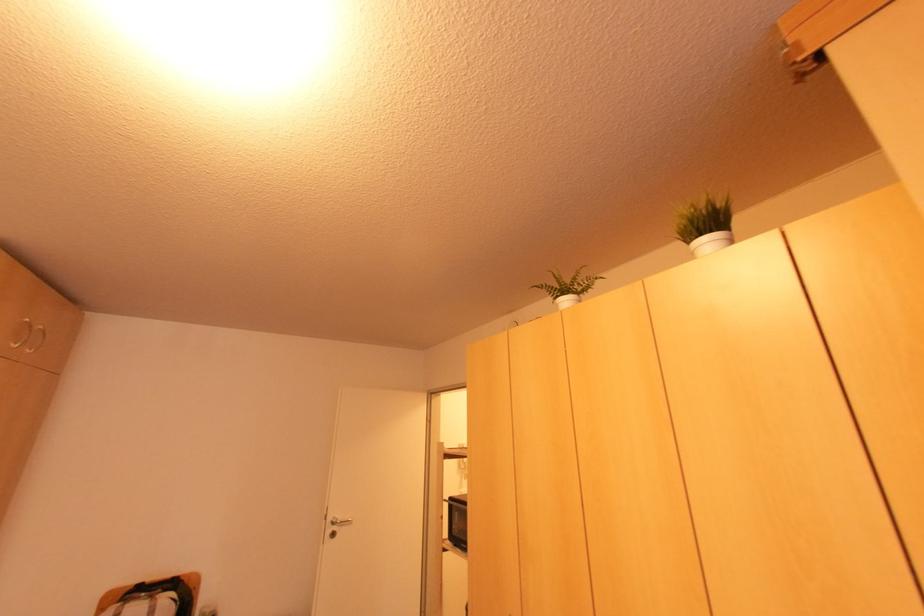
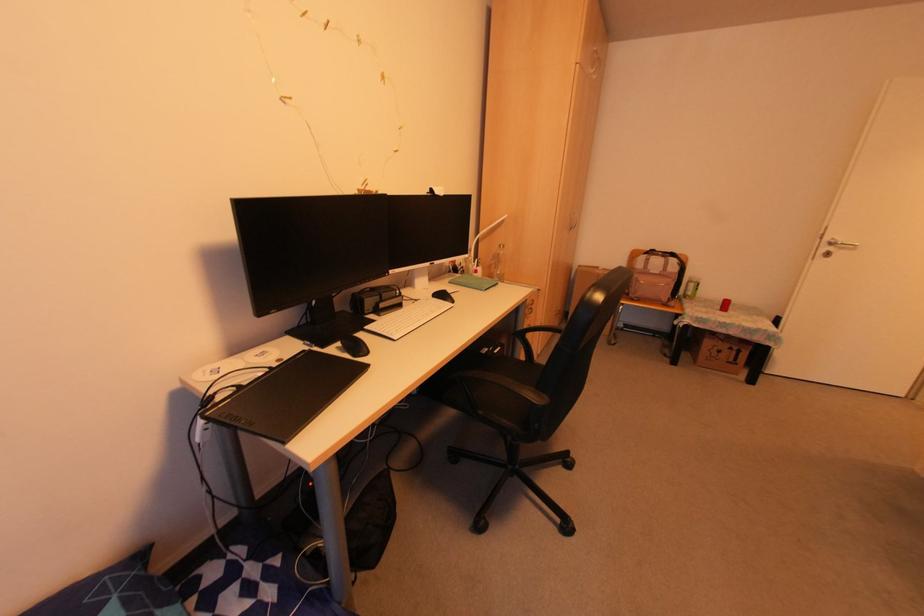
In the second image, find the point that corresponds to the point at 332,535 in the first image.

(825, 254)